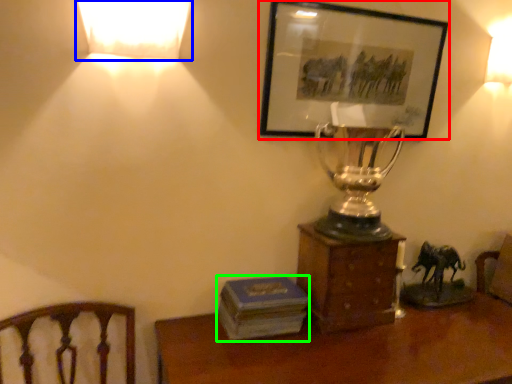
Question: Considering the real-world distances, which object is farthest from picture frame (highlighted by a red box)? lamp (highlighted by a blue box) or paperback book (highlighted by a green box)?

Choices:
 (A) lamp
 (B) paperback book

Answer: (B)